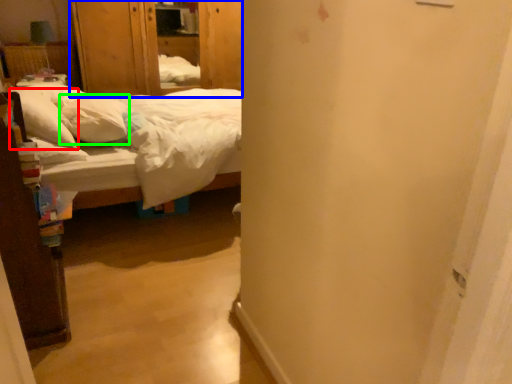
Question: Which object is the farthest from pillow (highlighted by a red box)? Choose among these: armoire (highlighted by a blue box) or pillow (highlighted by a green box).

Choices:
 (A) armoire
 (B) pillow

Answer: (A)